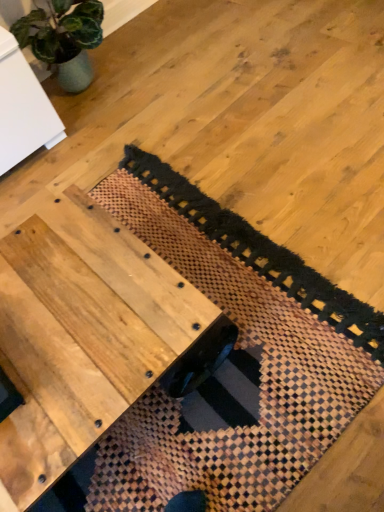
Identify the location of vacant space to the right of natural wood table at center. (263, 322).